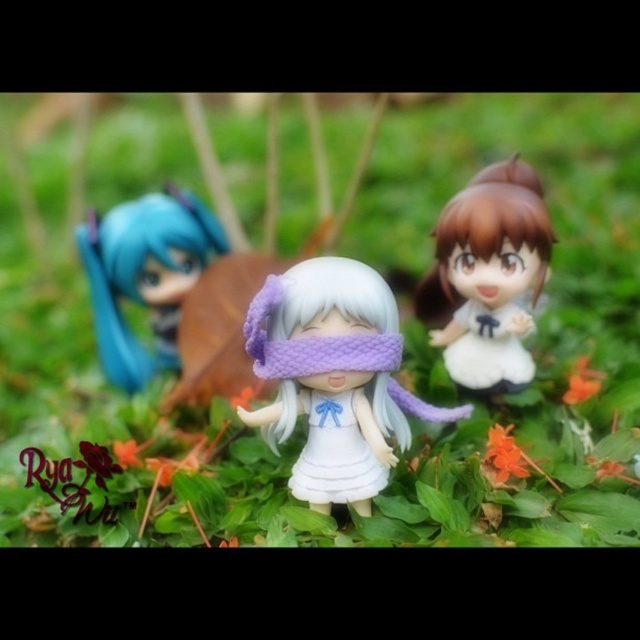
Question: Does white fabric doll at center appear over matte white figurine at center?

Choices:
 (A) yes
 (B) no

Answer: (B)

Question: Which point is closer to the camera taking this photo?

Choices:
 (A) (513, 314)
 (B) (340, 440)

Answer: (B)

Question: Which point appears farthest from the camera in this image?

Choices:
 (A) (339, 480)
 (B) (192, 266)
 (C) (360, 480)
 (D) (486, 170)

Answer: (B)

Question: Which point is closer to the camera?

Choices:
 (A) (307, 419)
 (B) (346, 282)
 (C) (173, 211)

Answer: (B)

Question: Can you confirm if matte blue hair at left is smaller than white matte dress at center?

Choices:
 (A) no
 (B) yes

Answer: (A)

Question: Does matte blue hair at left have a lesser width compared to white matte dress at center?

Choices:
 (A) yes
 (B) no

Answer: (B)